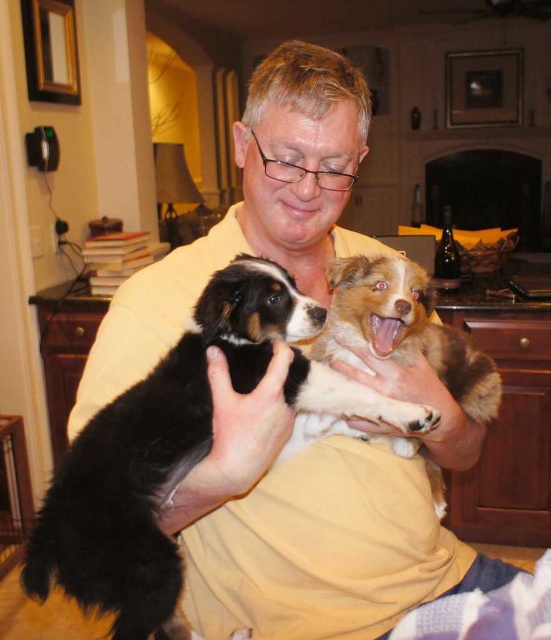
Question: Does black soft fur dog at center appear over brown fuzzy dog at center?

Choices:
 (A) no
 (B) yes

Answer: (A)

Question: Can you confirm if black soft fur dog at center is wider than brown fuzzy dog at center?

Choices:
 (A) yes
 (B) no

Answer: (A)

Question: Which object is farther from the camera taking this photo?

Choices:
 (A) brown fuzzy dog at center
 (B) black soft fur dog at center

Answer: (A)

Question: Does black soft fur dog at center appear over brown fuzzy dog at center?

Choices:
 (A) yes
 (B) no

Answer: (B)

Question: Which point is closer to the camera?

Choices:
 (A) (350, 328)
 (B) (224, 273)

Answer: (B)